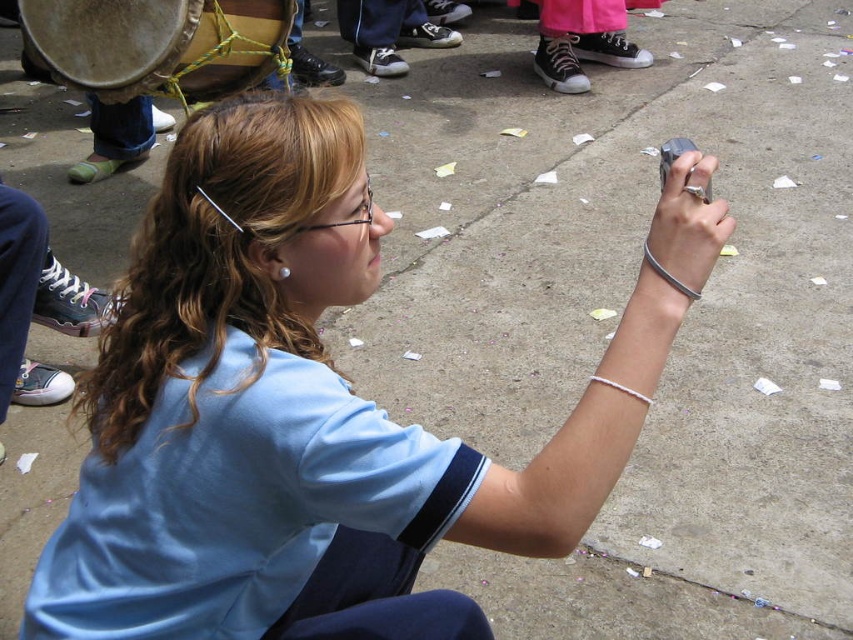
How far apart are wooden drum at left and pink canvas shoes at center?

A distance of 7.20 feet exists between wooden drum at left and pink canvas shoes at center.

Does wooden drum at left have a larger size compared to pink canvas shoes at center?

Incorrect, wooden drum at left is not larger than pink canvas shoes at center.

Image resolution: width=853 pixels, height=640 pixels. What do you see at coordinates (158, 44) in the screenshot?
I see `wooden drum at left` at bounding box center [158, 44].

At what (x,y) coordinates should I click in order to perform the action: click on wooden drum at left. Please return your answer as a coordinate pair (x, y). Looking at the image, I should click on (158, 44).